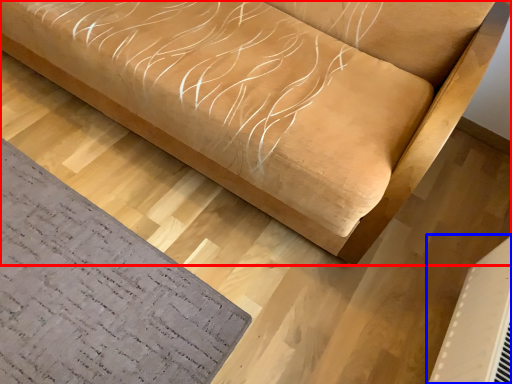
Question: Which point is closer to the camera, furniture (highlighted by a red box) or air conditioning (highlighted by a blue box)?

Choices:
 (A) furniture
 (B) air conditioning

Answer: (A)